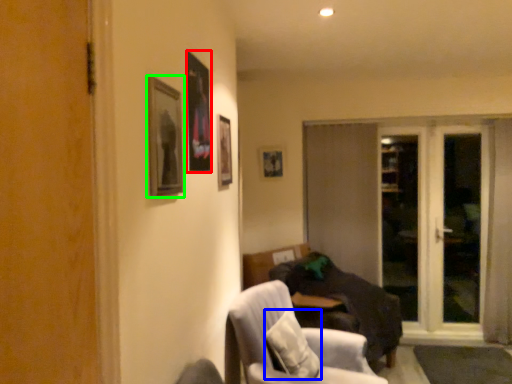
Question: Which object is positioned farthest from picture frame (highlighted by a red box)? Select from pillow (highlighted by a blue box) and picture frame (highlighted by a green box).

Choices:
 (A) pillow
 (B) picture frame

Answer: (A)